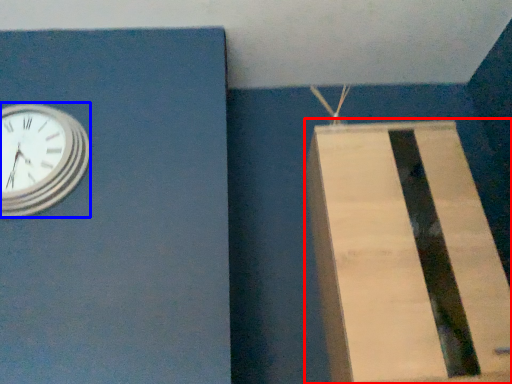
Question: Which object is further to the camera taking this photo, cardboard box (highlighted by a red box) or wall clock (highlighted by a blue box)?

Choices:
 (A) cardboard box
 (B) wall clock

Answer: (B)